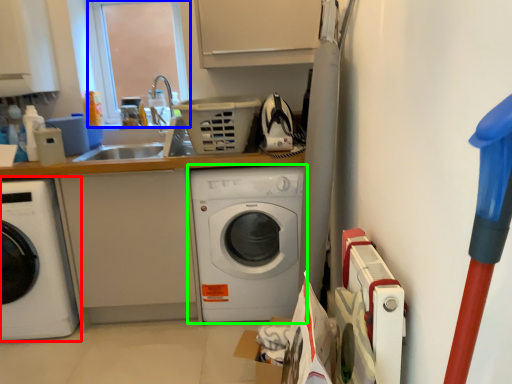
Question: Estimate the real-world distances between objects in this image. Which object is farther from washing machine (highlighted by a red box), window screen (highlighted by a blue box) or washing machine (highlighted by a green box)?

Choices:
 (A) window screen
 (B) washing machine

Answer: (A)